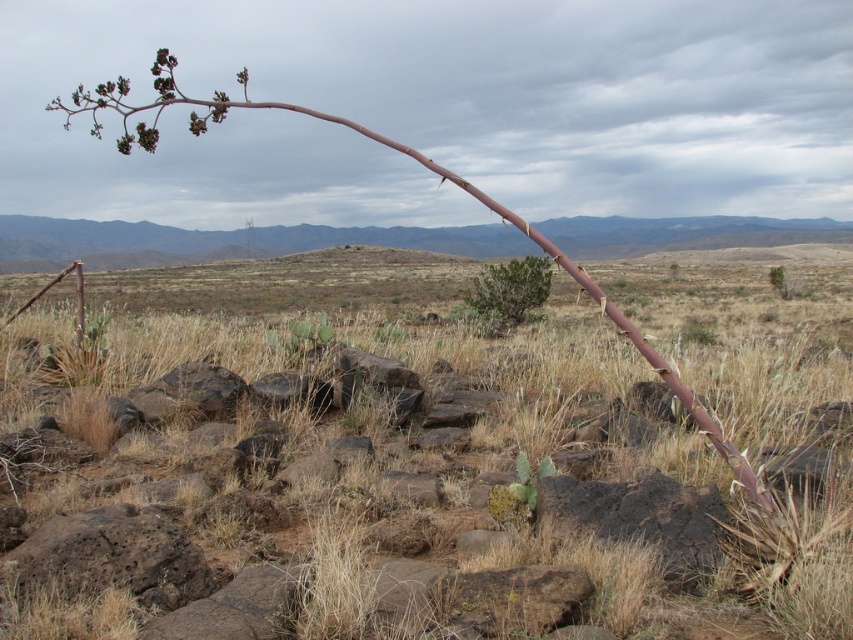
Question: In this image, where is brown grass at center located relative to green leafy bush at center?

Choices:
 (A) above
 (B) below

Answer: (B)

Question: Can you confirm if brown rough branch at left is positioned to the left of green leafy bush at center?

Choices:
 (A) no
 (B) yes

Answer: (B)

Question: Which object is the farthest from the brown grass at center?

Choices:
 (A) brown rough branch at left
 (B) green leafy bush at center

Answer: (A)

Question: Which point is closer to the camera taking this photo?

Choices:
 (A) (525, 262)
 (B) (32, 365)

Answer: (B)

Question: Which point is farther from the camera taking this photo?

Choices:
 (A) (616, 314)
 (B) (190, 536)

Answer: (B)

Question: Is brown grass at center to the right of green leafy bush at center from the viewer's perspective?

Choices:
 (A) no
 (B) yes

Answer: (A)